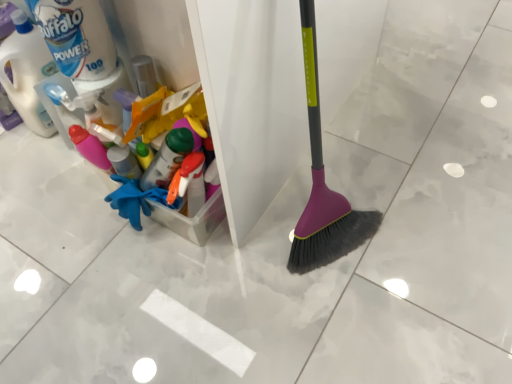
Question: Is matte white bottle at upper left not within matte white bottle at left?

Choices:
 (A) no
 (B) yes

Answer: (B)

Question: Is matte white bottle at upper left next to matte white bottle at left?

Choices:
 (A) yes
 (B) no

Answer: (B)

Question: Is matte white bottle at left at the back of matte white bottle at upper left?

Choices:
 (A) yes
 (B) no

Answer: (B)

Question: Considering the relative sizes of matte white bottle at upper left and matte white bottle at left in the image provided, is matte white bottle at upper left bigger than matte white bottle at left?

Choices:
 (A) yes
 (B) no

Answer: (B)

Question: Is the depth of matte white bottle at upper left less than that of matte white bottle at left?

Choices:
 (A) no
 (B) yes

Answer: (B)

Question: From the image's perspective, would you say matte white bottle at upper left is shown under matte white bottle at left?

Choices:
 (A) no
 (B) yes

Answer: (A)

Question: Can you confirm if matte white bottle at left is thinner than matte white bottle at upper left?

Choices:
 (A) no
 (B) yes

Answer: (A)

Question: Does matte white bottle at left have a lesser height compared to matte white bottle at upper left?

Choices:
 (A) yes
 (B) no

Answer: (B)

Question: Would you say matte white bottle at upper left is part of matte white bottle at left's contents?

Choices:
 (A) yes
 (B) no

Answer: (B)

Question: From a real-world perspective, is matte white bottle at left on matte white bottle at upper left?

Choices:
 (A) no
 (B) yes

Answer: (A)

Question: Is matte white bottle at left positioned with its back to matte white bottle at upper left?

Choices:
 (A) no
 (B) yes

Answer: (A)

Question: Can you confirm if matte white bottle at left is wider than matte white bottle at upper left?

Choices:
 (A) yes
 (B) no

Answer: (A)

Question: In terms of size, does matte white bottle at upper left appear bigger or smaller than matte white bottle at left?

Choices:
 (A) big
 (B) small

Answer: (B)